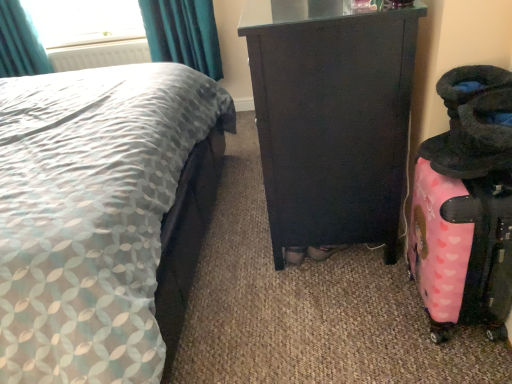
Question: From a real-world perspective, is matte gray fabric bed at left above or below pink matte suitcase at right?

Choices:
 (A) above
 (B) below

Answer: (A)

Question: Is matte gray fabric bed at left inside or outside of pink matte suitcase at right?

Choices:
 (A) outside
 (B) inside

Answer: (A)

Question: Based on their relative distances, which object is nearer to the matte gray fabric bed at left?

Choices:
 (A) pink matte suitcase at right
 (B) white plastic radiator at upper left
 (C) teal fabric curtain at upper left
 (D) matte black cabinet at center

Answer: (D)

Question: Which is nearer to the teal fabric curtain at upper left?

Choices:
 (A) white plastic radiator at upper left
 (B) pink matte suitcase at right
 (C) matte black cabinet at center
 (D) matte gray fabric bed at left

Answer: (A)